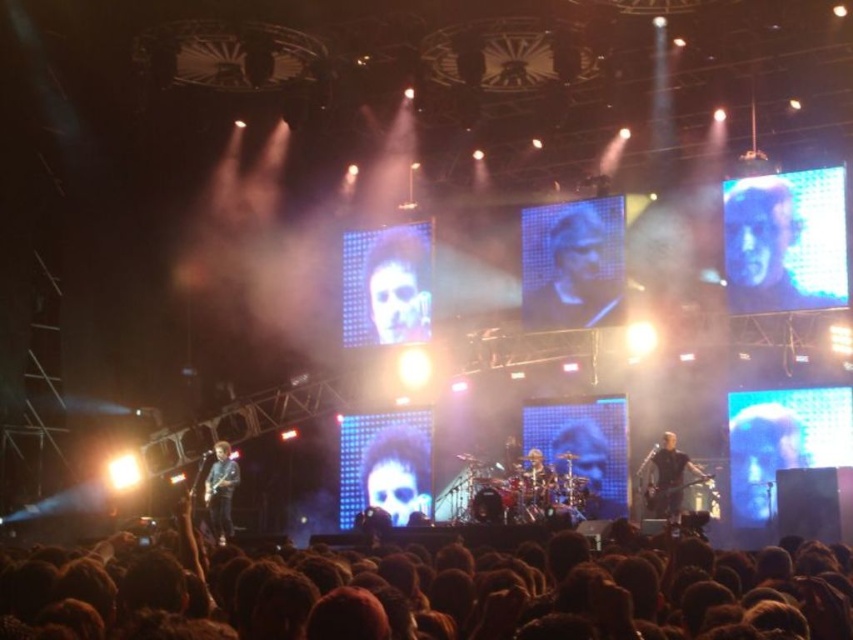
You are standing in the audience at the concert and want to take a photo of two points on the stage. The first point is at coordinate point (750, 406) and the second is at point (234, 480). Which point will appear larger in your photo?

Point (750, 406) is closer to the viewer than point (234, 480), so it will appear larger in the photo.

You are a photographer at the concert and want to capture both the black leather jacket at center and the blue denim jacket at lower left in a single shot. Which jacket will appear larger in the photo?

The black leather jacket at center will appear larger in the photo because it is much taller than the blue denim jacket at lower left.